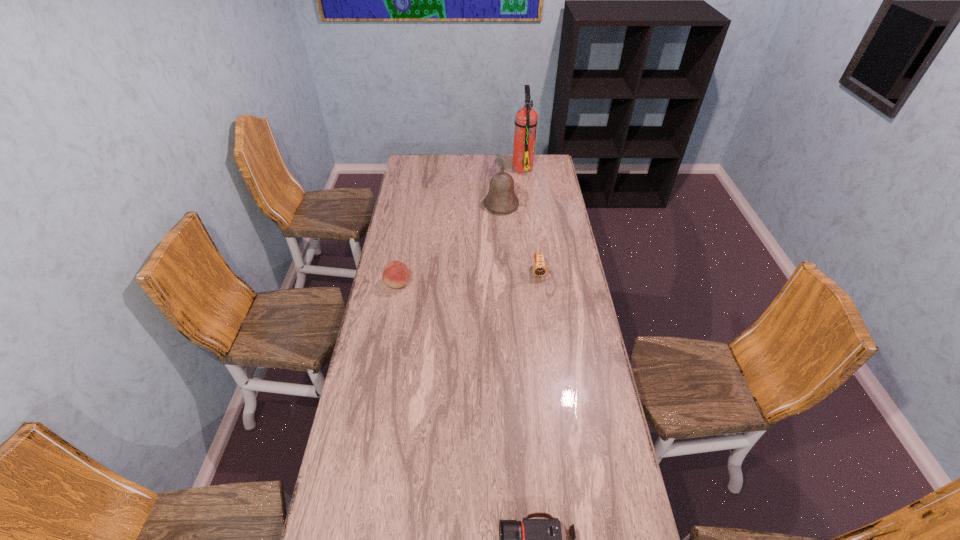
What are the coordinates of `fire extinguisher` in the screenshot? It's located at (526, 118).

Image resolution: width=960 pixels, height=540 pixels. Identify the location of the farthest object. (526, 118).

Identify the location of the second tallest object. The image size is (960, 540). (501, 198).

Where is `bell`? bell is located at coordinates (501, 198).

I want to click on peach, so click(395, 274).

You are a GUI agent. You are given a task and a screenshot of the screen. Output one action in this format:
    pyautogui.click(x=<x>, y=<y>)
    Task: Click on the watch
    This screenshot has height=540, width=960.
    Given the screenshot: What is the action you would take?
    pyautogui.click(x=539, y=269)

Image resolution: width=960 pixels, height=540 pixels. Identify the location of free location located 0.230m at the nozzle of the fire extinguisher. click(x=472, y=167).

This screenshot has height=540, width=960. Identify the location of blank area located at the nozzle of the fire extinguisher. (450, 167).

Find the location of a particular element. vacant point located 0.060m at the nozzle of the fire extinguisher is located at coordinates (501, 167).

Identify the location of free point located 0.210m on the right of the bell. (559, 205).